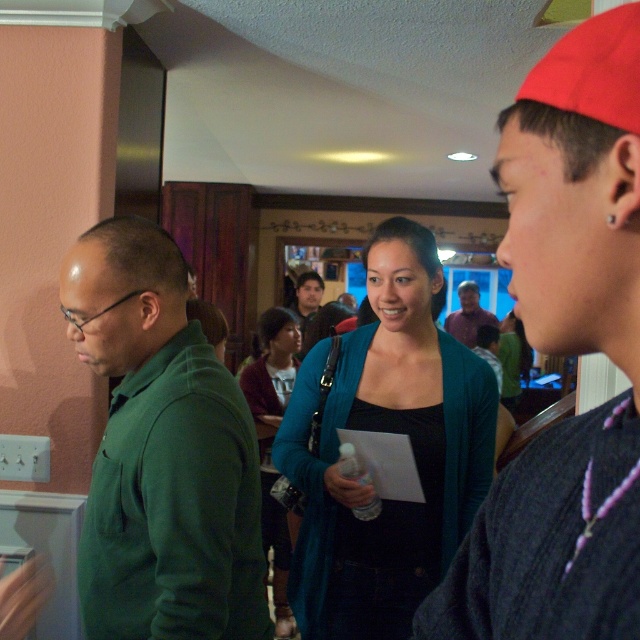
Question: Is matte red cap at right to the left of green matte sweater at left from the viewer's perspective?

Choices:
 (A) no
 (B) yes

Answer: (A)

Question: Is green matte sweater at left wider than teal cardigan at center?

Choices:
 (A) no
 (B) yes

Answer: (A)

Question: Is teal cardigan at center wider than matte black shirt at center?

Choices:
 (A) yes
 (B) no

Answer: (A)

Question: Which of the following is the farthest from the observer?

Choices:
 (A) (451, 316)
 (B) (115, 436)

Answer: (A)

Question: Which object is closer to the camera taking this photo?

Choices:
 (A) green matte sweater at left
 (B) matte teal sweater at center

Answer: (A)

Question: Among these objects, which one is farthest from the camera?

Choices:
 (A) green matte sweater at left
 (B) matte purple shirt at center
 (C) matte black shirt at center

Answer: (B)